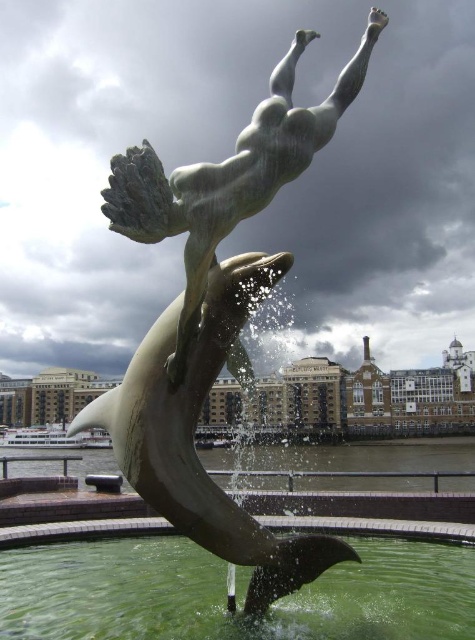
Is green liquid water at center positioned behind bronze statue at center?

No, it is not.

Does green liquid water at center appear on the left side of bronze statue at center?

No, green liquid water at center is not to the left of bronze statue at center.

What do you see at coordinates (225, 588) in the screenshot? This screenshot has height=640, width=475. I see `green liquid water at center` at bounding box center [225, 588].

The height and width of the screenshot is (640, 475). I want to click on green liquid water at center, so click(x=225, y=588).

Does green liquid water at center have a greater width compared to shiny silver dolphin at center?

Yes.

Between point (420, 563) and point (209, 506), which one is positioned behind?

The point (420, 563) is more distant.

Find the location of a particular element. This screenshot has width=475, height=640. green liquid water at center is located at coordinates (225, 588).

The height and width of the screenshot is (640, 475). I want to click on shiny silver dolphin at center, so click(x=193, y=433).